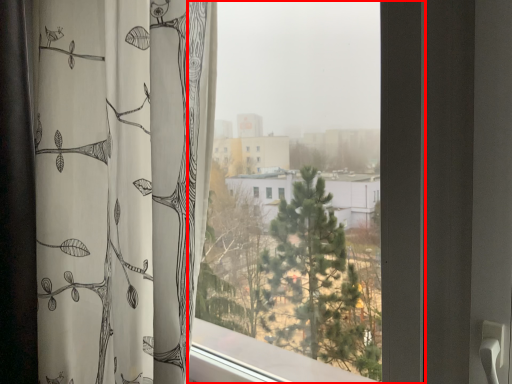
Question: From the image's perspective, considering the relative positions of window (annotated by the red box) and curtain in the image provided, where is window (annotated by the red box) located with respect to the staircase?

Choices:
 (A) above
 (B) below

Answer: (A)